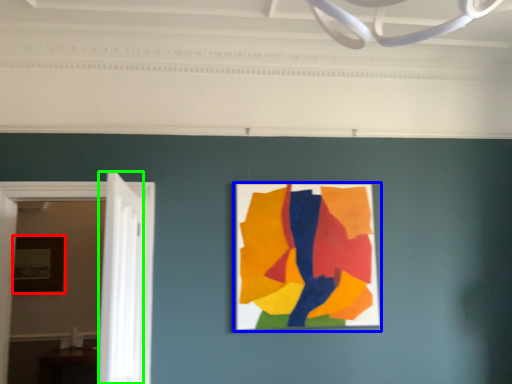
Question: Considering the real-world distances, which object is closest to picture frame (highlighted by a red box)? picture frame (highlighted by a blue box) or door (highlighted by a green box).

Choices:
 (A) picture frame
 (B) door

Answer: (B)